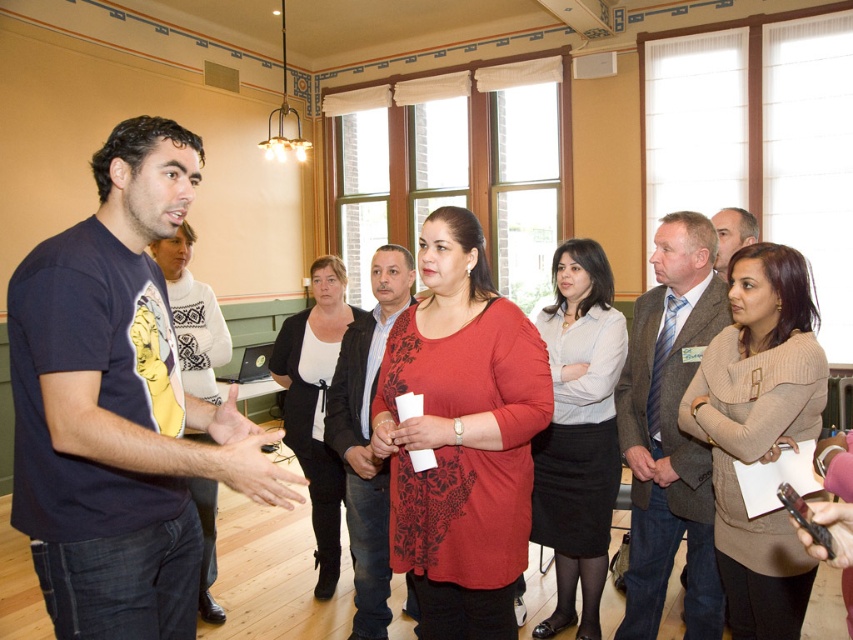
You are standing in the room and want to hand a document to the person wearing the light blue shirt at center. Considering the distance between you and them, is it feasible to throw the document to them without leaving your current position?

The light blue shirt at center is 8.62 feet away from the viewer. Throwing a document that distance might be possible, but it could result in the document landing inaccurately or being damaged. It is advisable to approach closer for a safer and more reliable handoff.